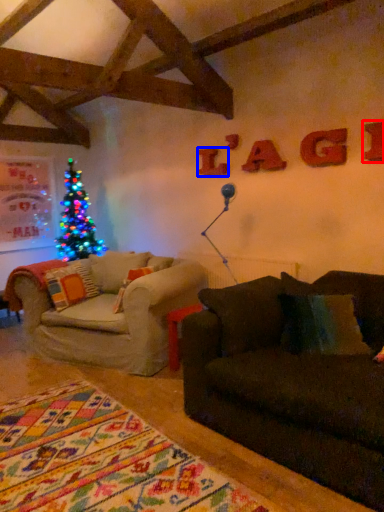
Question: Which of the following is the farthest to the observer, letter (highlighted by a red box) or letter (highlighted by a blue box)?

Choices:
 (A) letter
 (B) letter

Answer: (B)